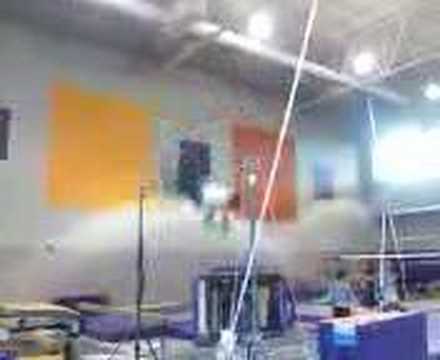
I want to click on wall, so click(20, 209).